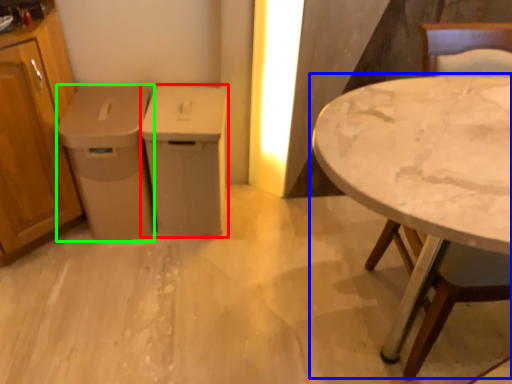
Question: Which is nearer to the cabinetry (highlighted by a red box)? table (highlighted by a blue box) or cabinetry (highlighted by a green box).

Choices:
 (A) table
 (B) cabinetry

Answer: (B)